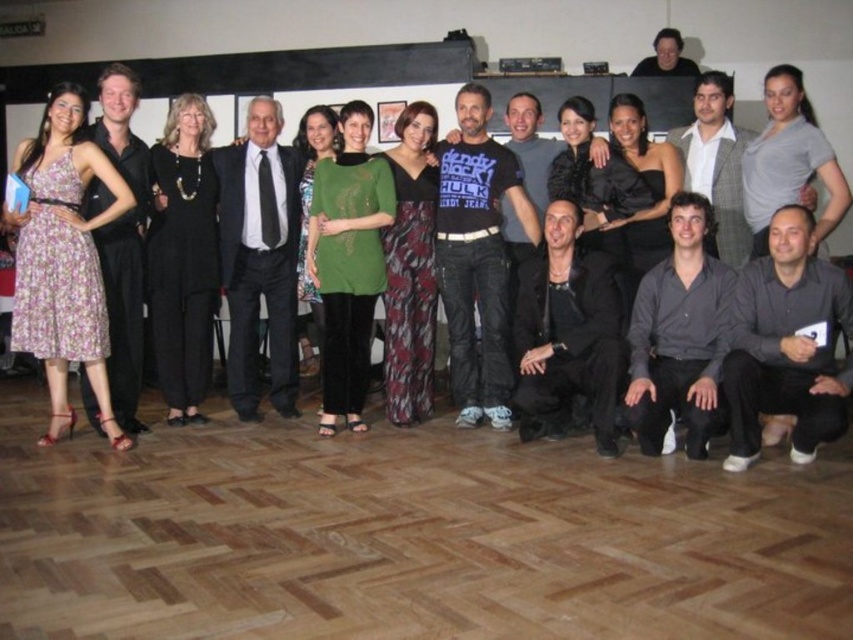
You are a photographer trying to adjust the lighting for a group photo. You need to ensure that the black leather jacket at lower center and the dark gray shirt at lower right are both well lit. Which object is closer to the left side of the frame to help you position the lights?

The black leather jacket at lower center is positioned on the left side of the dark gray shirt at lower right, so it is closer to the left side of the frame.

You are standing in the room and want to move from the point closer to you to the point further away. Which path should you take? The points are labeled as point (701, 348) and point (138, 252). Please specify the coordinates of both points in your answer.

The point closer to the viewer is point (701, 348), and the point further away is point (138, 252). To move from the closer point to the further one, you should head towards the direction of the lower left part of the room since the further point is located at lower left coordinates compared to the closer point.